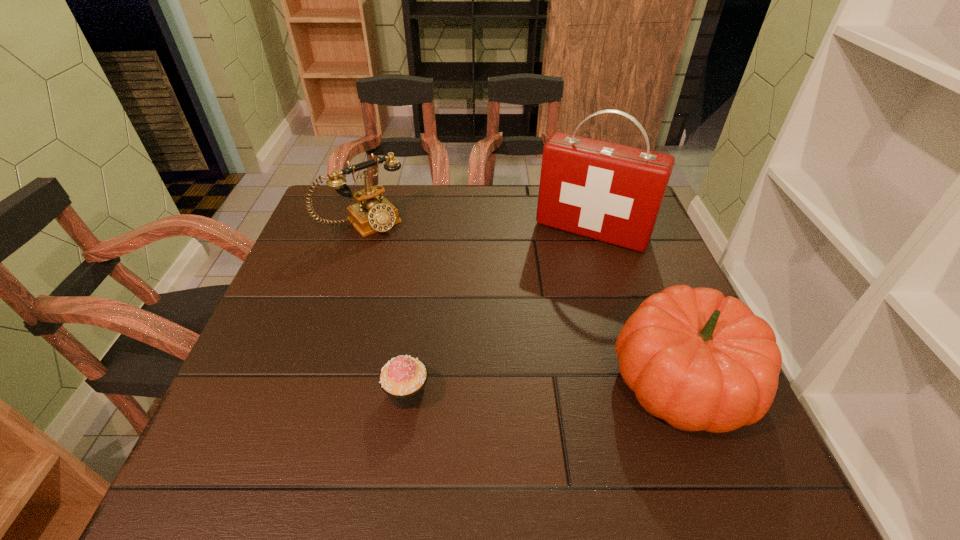
This screenshot has height=540, width=960. Find the location of `free space located 0.120m on the front face of the tallest object`. free space located 0.120m on the front face of the tallest object is located at coordinates (557, 281).

At what (x,y) coordinates should I click in order to perform the action: click on free space located 0.340m on the front face of the tallest object. Please return your answer as a coordinate pair (x, y). This screenshot has height=540, width=960. Looking at the image, I should click on (522, 346).

You are a GUI agent. You are given a task and a screenshot of the screen. Output one action in this format:
    pyautogui.click(x=<x>, y=<y>)
    Task: Click on the vacant space located on the front face of the tallest object
    
    Given the screenshot: What is the action you would take?
    pyautogui.click(x=564, y=269)

This screenshot has height=540, width=960. Identify the location of telephone situated at the far edge. (372, 213).

Where is `the first-aid kit located at the far edge`? the first-aid kit located at the far edge is located at coordinates (609, 192).

At what (x,y) coordinates should I click in order to perform the action: click on cupcake that is at the near edge. Please return your answer as a coordinate pair (x, y). The height and width of the screenshot is (540, 960). Looking at the image, I should click on (403, 379).

Where is `pumpkin located in the near edge section of the desktop`? pumpkin located in the near edge section of the desktop is located at coordinates (698, 360).

Find the location of a particular element. object located at the left edge is located at coordinates (372, 213).

I want to click on pumpkin present at the right edge, so click(x=698, y=360).

This screenshot has height=540, width=960. Identify the location of the first-aid kit present at the right edge. (609, 192).